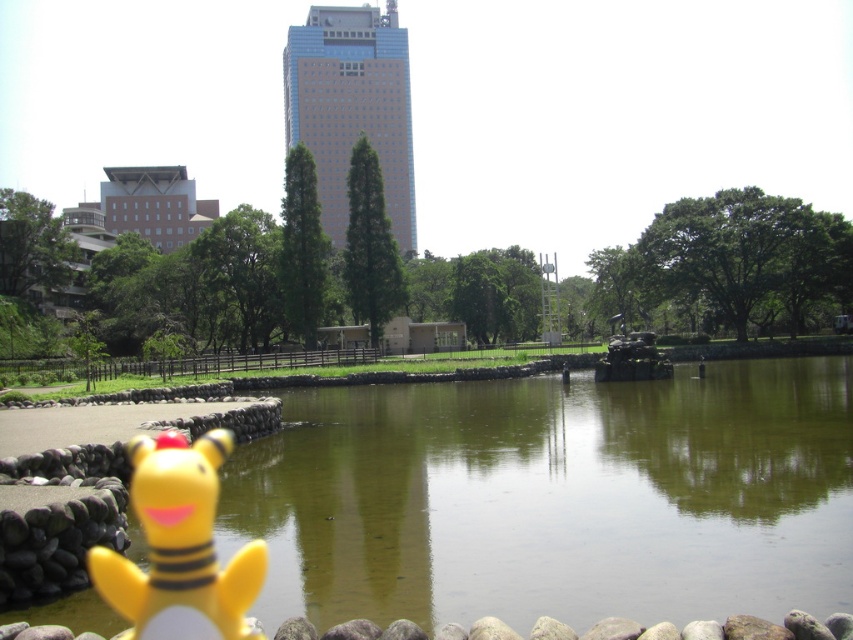
Question: Is green smooth water at center positioned in front of yellow matte plush toy at lower left?

Choices:
 (A) no
 (B) yes

Answer: (A)

Question: Can you confirm if green smooth water at center is positioned to the right of yellow matte plush toy at lower left?

Choices:
 (A) yes
 (B) no

Answer: (A)

Question: Among these points, which one is farthest from the camera?

Choices:
 (A) (447, 458)
 (B) (96, 573)

Answer: (A)

Question: Which point is closer to the camera?

Choices:
 (A) (296, 534)
 (B) (120, 566)

Answer: (B)

Question: Is green smooth water at center to the right of yellow matte plush toy at lower left from the viewer's perspective?

Choices:
 (A) no
 (B) yes

Answer: (B)